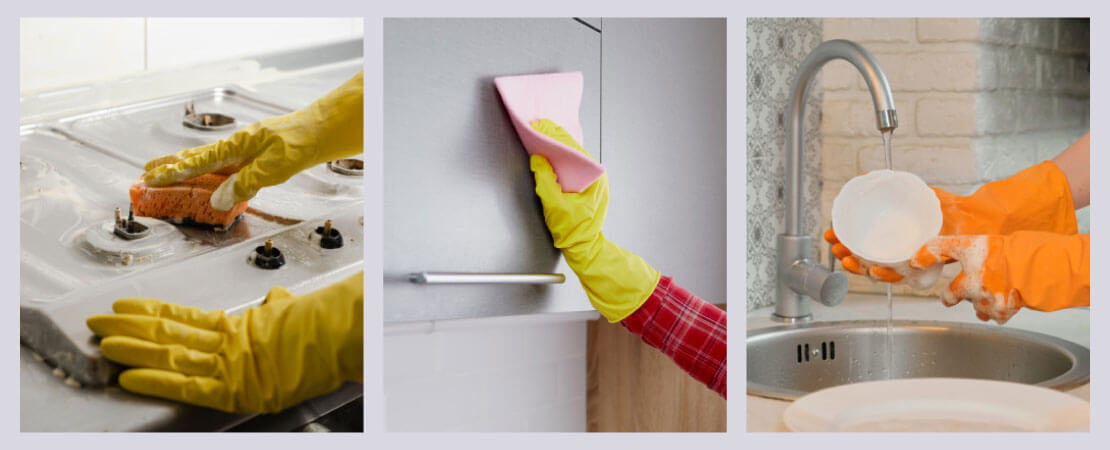
Locate an element on the screen. The width and height of the screenshot is (1110, 450). wooden wall is located at coordinates (647, 407).